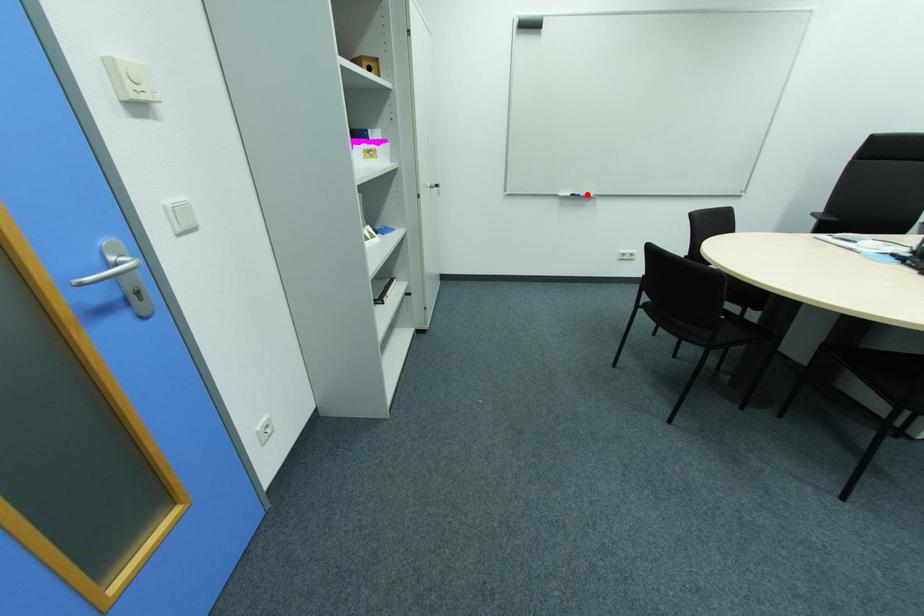
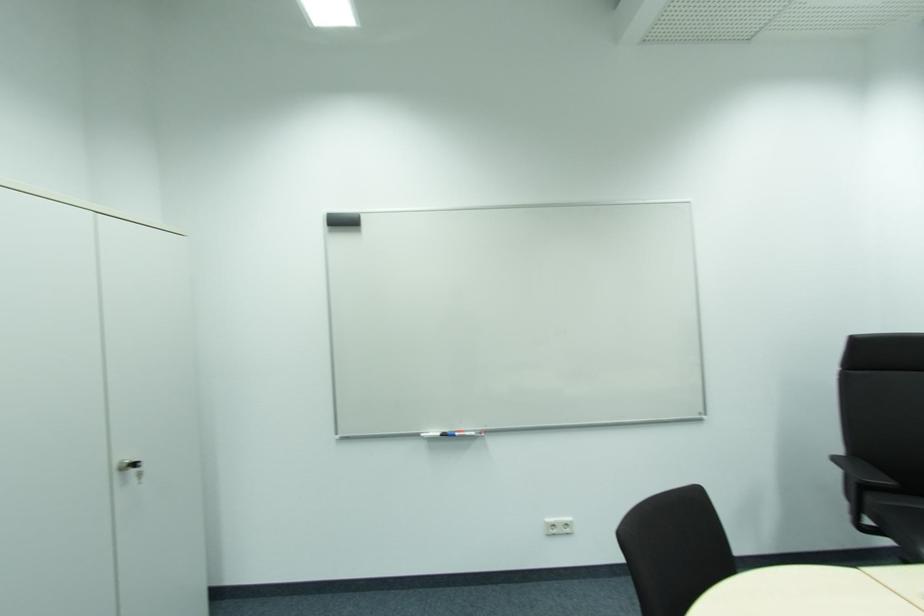
Locate, in the second image, the point that corresponds to the highlighted location in the first image.

(464, 434)